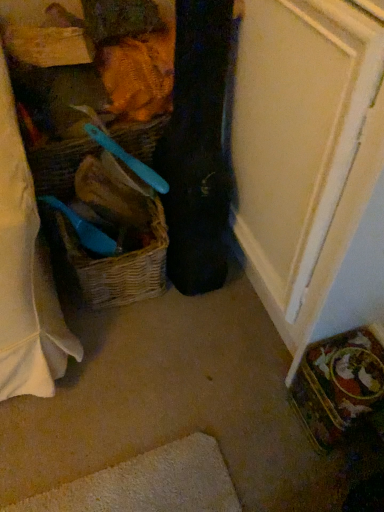
Question: Relative to woven brown picnic basket at left, is woven straw basket at center in front or behind?

Choices:
 (A) front
 (B) behind

Answer: (A)

Question: Does point (144, 160) appear closer or farther from the camera than point (56, 217)?

Choices:
 (A) closer
 (B) farther

Answer: (B)

Question: Which object is the farthest from the woven straw basket at center?

Choices:
 (A) black fabric guitar case at center
 (B) woven brown picnic basket at left

Answer: (A)

Question: Which object is the closest to the woven brown picnic basket at left?

Choices:
 (A) black fabric guitar case at center
 (B) woven straw basket at center

Answer: (A)